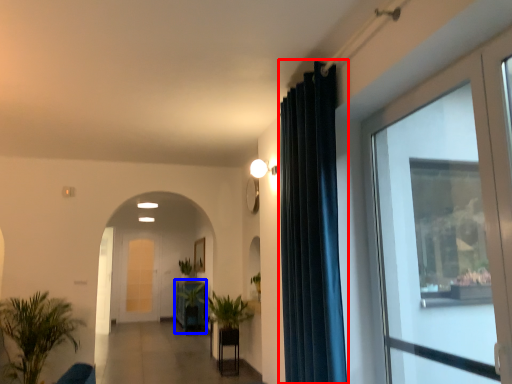
Question: Which point is further to the camera, curtain (highlighted by a red box) or furniture (highlighted by a blue box)?

Choices:
 (A) curtain
 (B) furniture

Answer: (B)